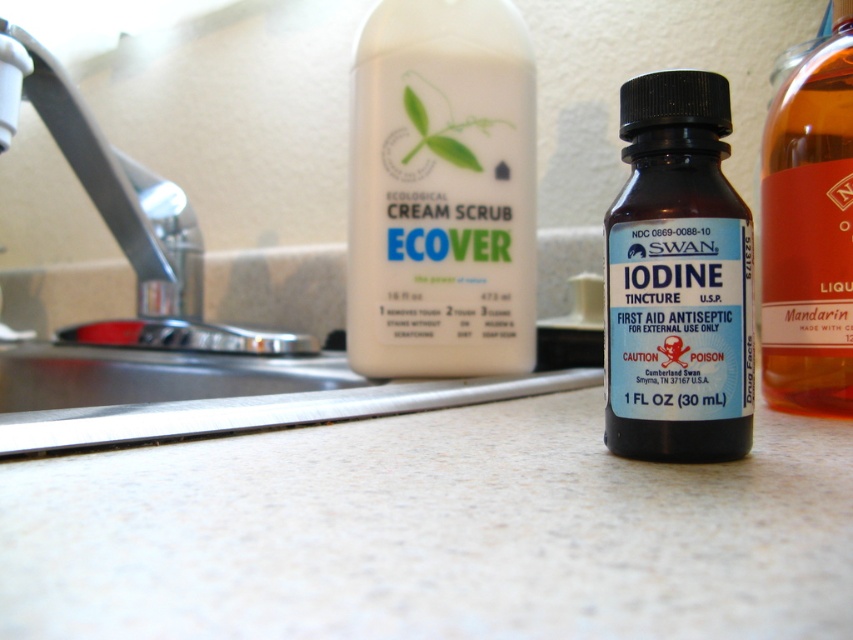
Which is behind, point (648, 422) or point (827, 280)?

Positioned behind is point (827, 280).

Is matte black iodine tincture at center to the right of amber glass bottle at right from the viewer's perspective?

Incorrect, matte black iodine tincture at center is not on the right side of amber glass bottle at right.

Between point (734, 429) and point (849, 65), which one is positioned behind?

The point (849, 65) is behind.

The width and height of the screenshot is (853, 640). I want to click on matte black iodine tincture at center, so click(677, 276).

Can you confirm if white matte cream scrub at center is positioned to the left of silver metallic faucet at left?

In fact, white matte cream scrub at center is to the right of silver metallic faucet at left.

In the scene shown: Can you confirm if white matte cream scrub at center is smaller than silver metallic faucet at left?

Yes.

Does point (398, 163) come farther from viewer compared to point (90, 164)?

No, (398, 163) is closer to viewer.

This screenshot has width=853, height=640. In order to click on white matte cream scrub at center in this screenshot , I will do `click(440, 192)`.

Which is in front, point (7, 529) or point (183, 237)?

Point (7, 529)

Based on the photo, is white speckled laminate at center smaller than silver metallic faucet at left?

Indeed, white speckled laminate at center has a smaller size compared to silver metallic faucet at left.

Describe the element at coordinates (433, 532) in the screenshot. I see `white speckled laminate at center` at that location.

Image resolution: width=853 pixels, height=640 pixels. Identify the location of white speckled laminate at center. (433, 532).